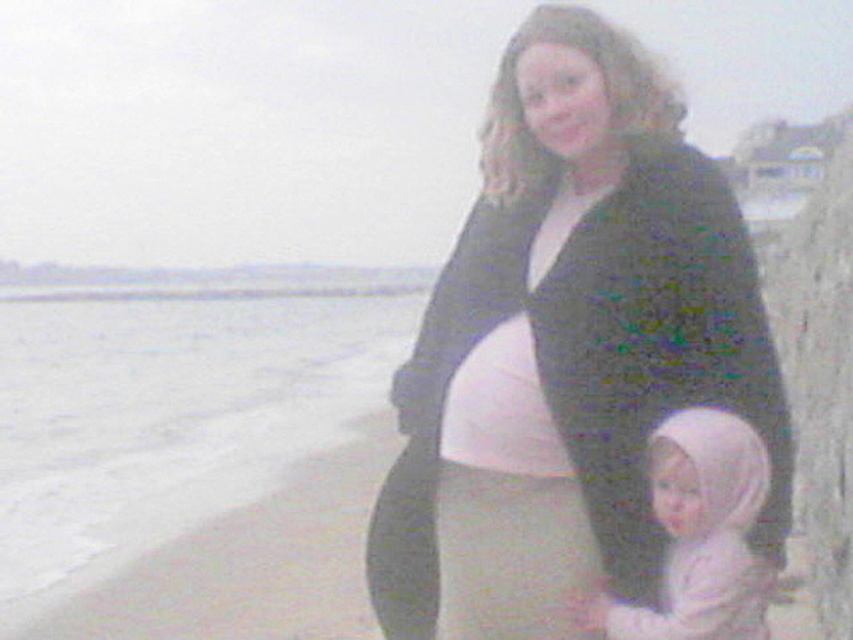
You are a photographer trying to capture a photo of both the woman and the child in the scene. You notice two points marked in the image. The first point is at coordinates point (590, 552) and the second point is at coordinates point (761, 579). Which point should you focus on to ensure both subjects are in the frame?

Point (761, 579) should be focused on because it is in front of point (590, 552), ensuring both subjects are within the frame.

You are a photographer trying to capture a clear shot of both the matte black sweater at center and the pink fabric baby at lower center. Which object should you focus on first to ensure both are in focus?

You should focus on the matte black sweater at center first because it is closer to you than the pink fabric baby at lower center. By focusing on the closer object, the farther one may still be in the depth of field, ensuring both are sharp.